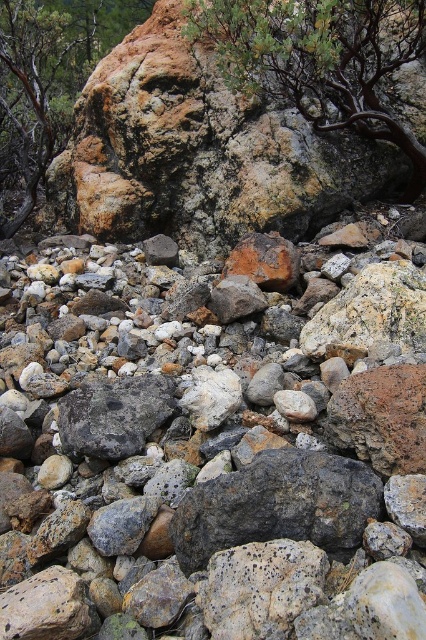
The height and width of the screenshot is (640, 426). I want to click on speckled stone at center, so click(212, 449).

Which is in front, point (135, 384) or point (37, 116)?

Point (135, 384)

Which is behind, point (37, 348) or point (31, 74)?

Positioned behind is point (31, 74).

Image resolution: width=426 pixels, height=640 pixels. What are the coordinates of `speckled stone at center` in the screenshot? It's located at (212, 449).

Does smooth brown tree trunk at upper center have a smaller size compared to gray rough rock at center?

Incorrect, smooth brown tree trunk at upper center is not smaller in size than gray rough rock at center.

Can you confirm if smooth brown tree trunk at upper center is positioned below gray rough rock at center?

No, smooth brown tree trunk at upper center is not below gray rough rock at center.

You are a GUI agent. You are given a task and a screenshot of the screen. Output one action in this format:
    pyautogui.click(x=<x>, y=<y>)
    Task: Click on the smooth brown tree trunk at upper center
    The height and width of the screenshot is (640, 426).
    Given the screenshot: What is the action you would take?
    pyautogui.click(x=319, y=60)

Who is positioned more to the left, green textured rock at upper center or gray rough rock at center?

green textured rock at upper center

Where is `green textured rock at upper center`? green textured rock at upper center is located at coordinates (48, 83).